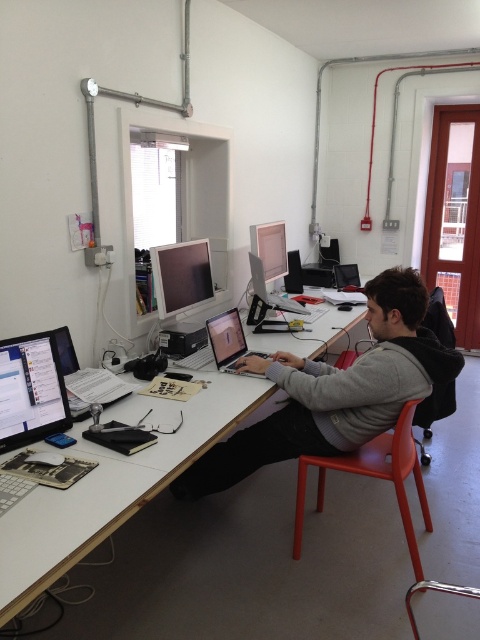
Based on the photo, between gray sweater at center and matte black monitor at left, which one is positioned lower?

gray sweater at center is below.

Measure the distance between point (247, 451) and camera.

Point (247, 451) is 8.11 feet from camera.

Identify the location of gray sweater at center. (335, 392).

Does matte plastic monitor at center have a greater height compared to matte black laptop at center?

Yes.

Who is lower down, matte plastic monitor at center or matte black laptop at center?

matte black laptop at center is below.

Who is more distant from viewer, (x=201, y=259) or (x=219, y=332)?

Point (x=201, y=259)

You are a GUI agent. You are given a task and a screenshot of the screen. Output one action in this format:
    pyautogui.click(x=<x>, y=<y>)
    Task: Click on the matte plastic monitor at center
    This screenshot has width=480, height=640.
    Given the screenshot: What is the action you would take?
    pyautogui.click(x=181, y=276)

How far apart are gray sweater at center and matte white monitor at upper center?

gray sweater at center and matte white monitor at upper center are 4.11 feet apart.

Is gray sweater at center above matte white monitor at upper center?

Actually, gray sweater at center is below matte white monitor at upper center.

Is point (292, 392) positioned in front of point (273, 224)?

Yes.

Locate an element on the screen. This screenshot has width=480, height=640. gray sweater at center is located at coordinates (335, 392).